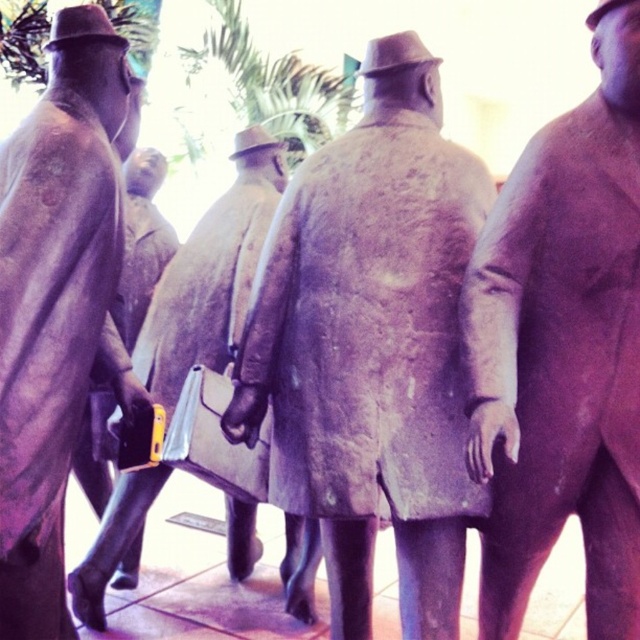
In the scene shown: Which is below, matte bronze statue at center or matte brown briefcase at center?

matte brown briefcase at center is below.

Which is in front, point (35, 282) or point (260, 198)?

Positioned in front is point (35, 282).

Between point (52, 259) and point (204, 262), which one is positioned in front?

Point (52, 259) is more forward.

In order to click on matte bronze statue at center in this screenshot , I will do `click(58, 305)`.

Is the position of matte brown coat at center more distant than that of matte brown briefcase at center?

That is False.

Does matte brown coat at center have a lesser height compared to matte brown briefcase at center?

Yes.

Locate an element on the screen. This screenshot has height=640, width=640. matte brown coat at center is located at coordinates (563, 349).

Locate an element on the screen. The image size is (640, 640). matte brown coat at center is located at coordinates click(563, 349).

Who is higher up, matte brown coat at center or matte bronze statue at center?

matte bronze statue at center is above.

Describe the element at coordinates (563, 349) in the screenshot. I see `matte brown coat at center` at that location.

Identify the location of matte brown coat at center. (563, 349).